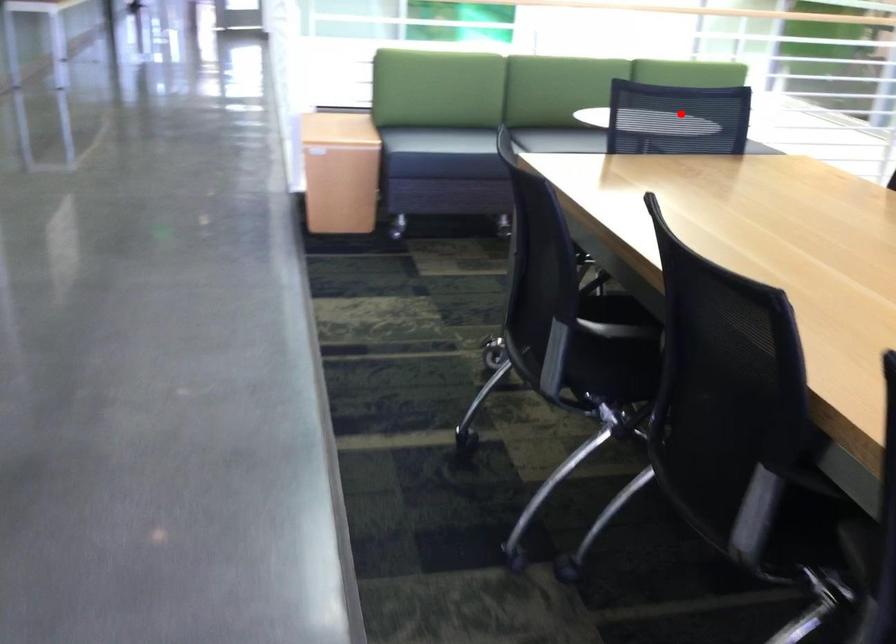
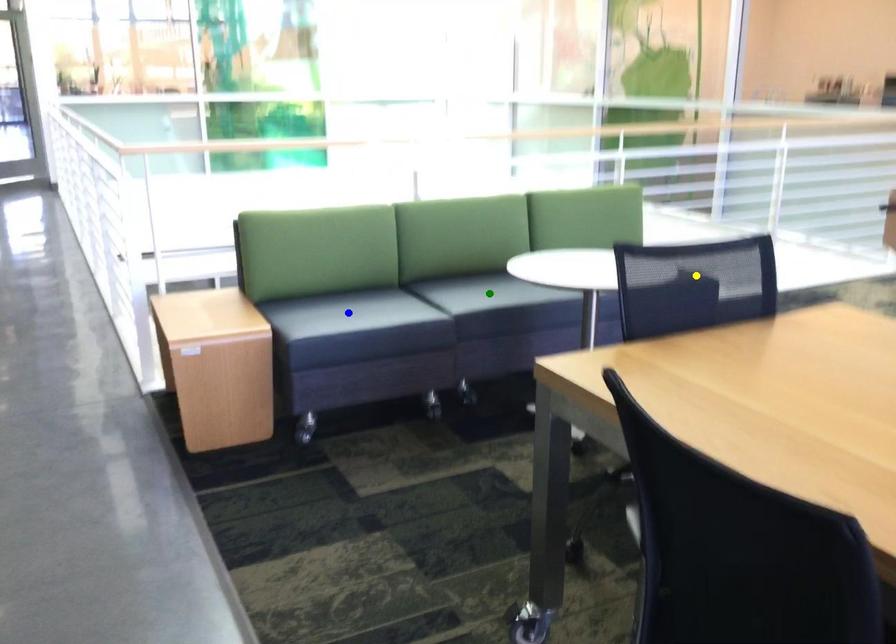
Question: I am providing you with two images of the same scene from different viewpoints. A red point is marked on the first image. You are given multiple points on the second image. Which spot in image 2 lines up with the point in image 1?

Choices:
 (A) yellow point
 (B) blue point
 (C) green point

Answer: (A)